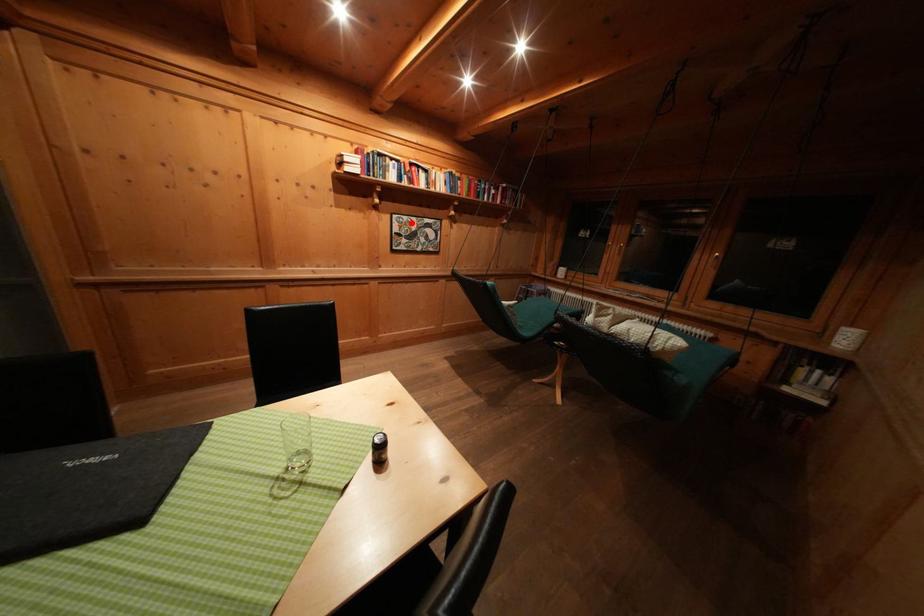
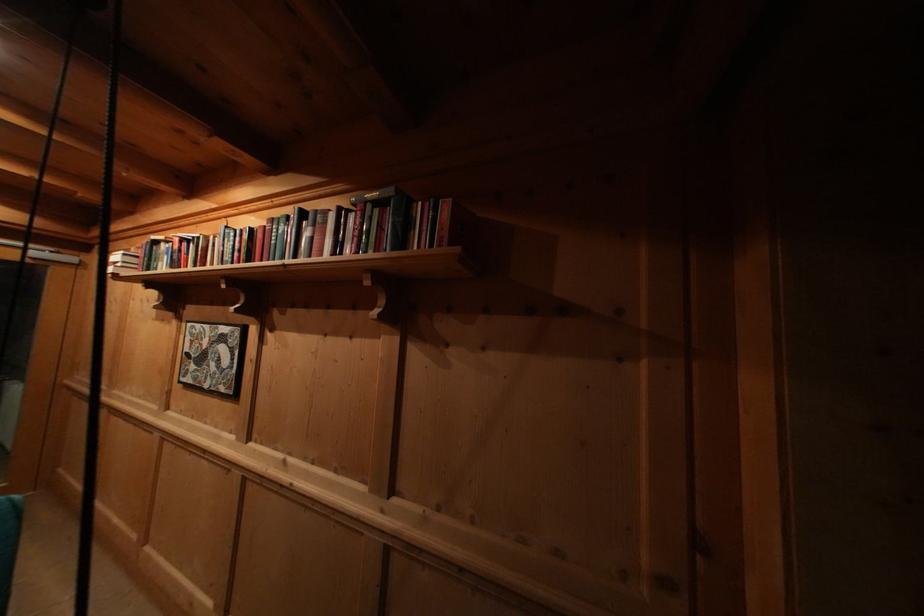
Locate, in the second image, the point that corresponds to the highlighted location in the first image.

(204, 331)